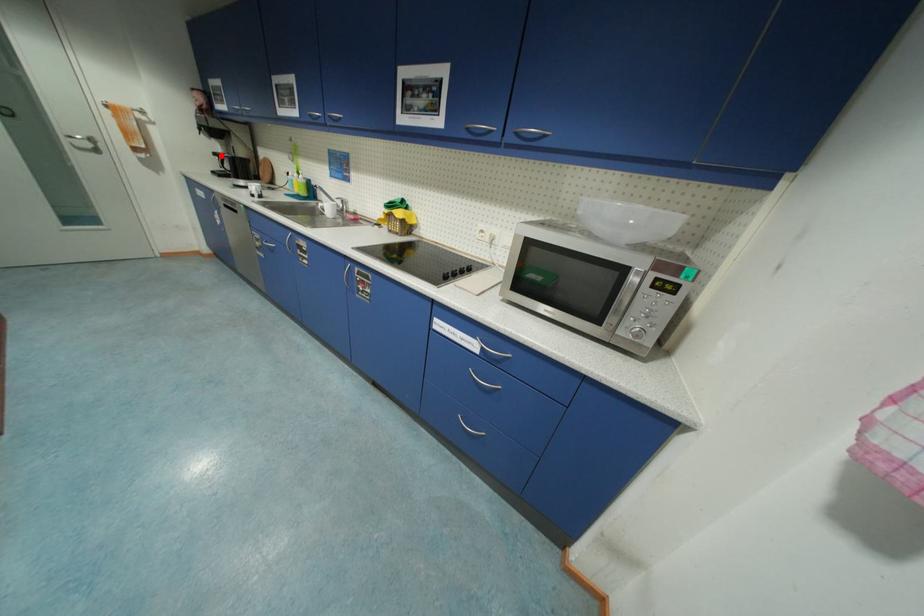
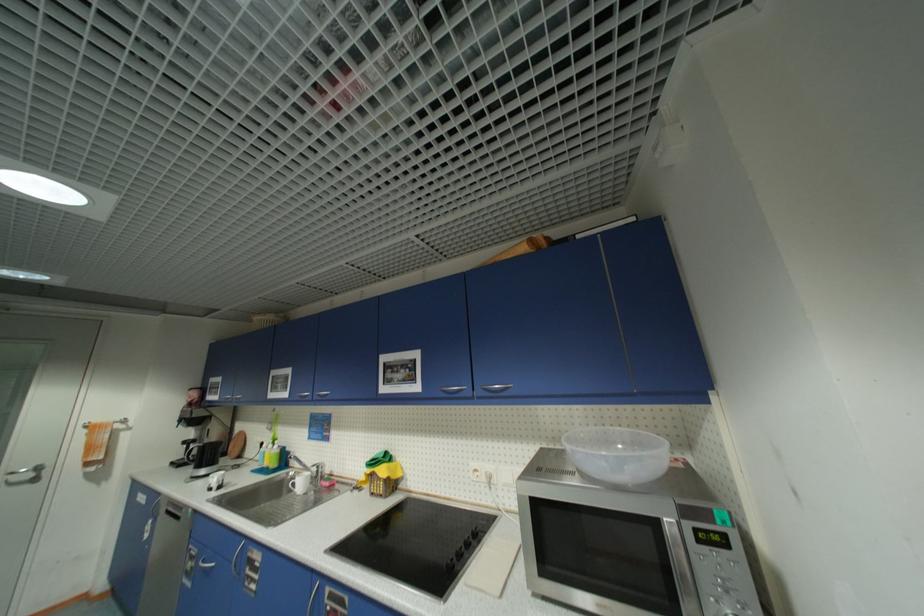
Where in the second image is the point corresponding to the highlighted location from the first image?

(190, 444)